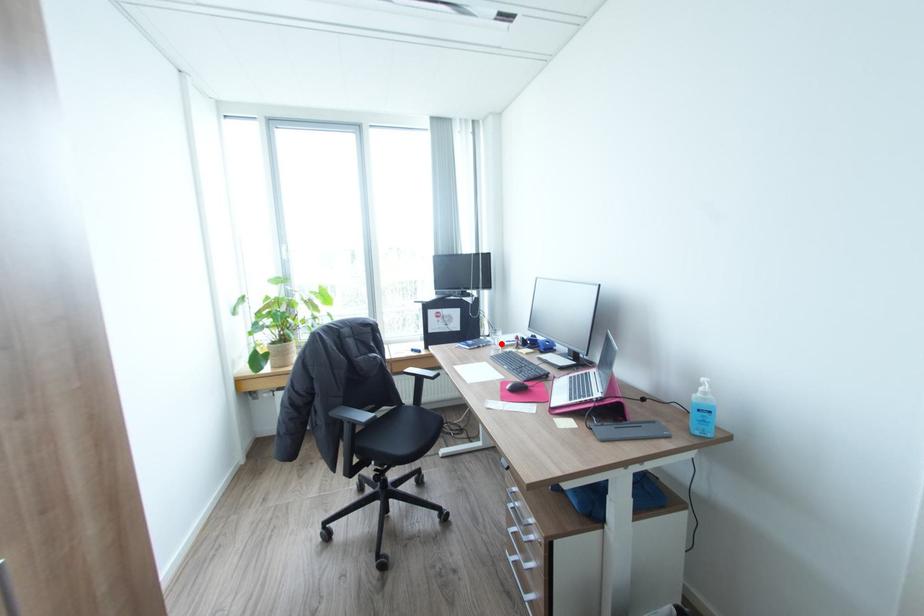
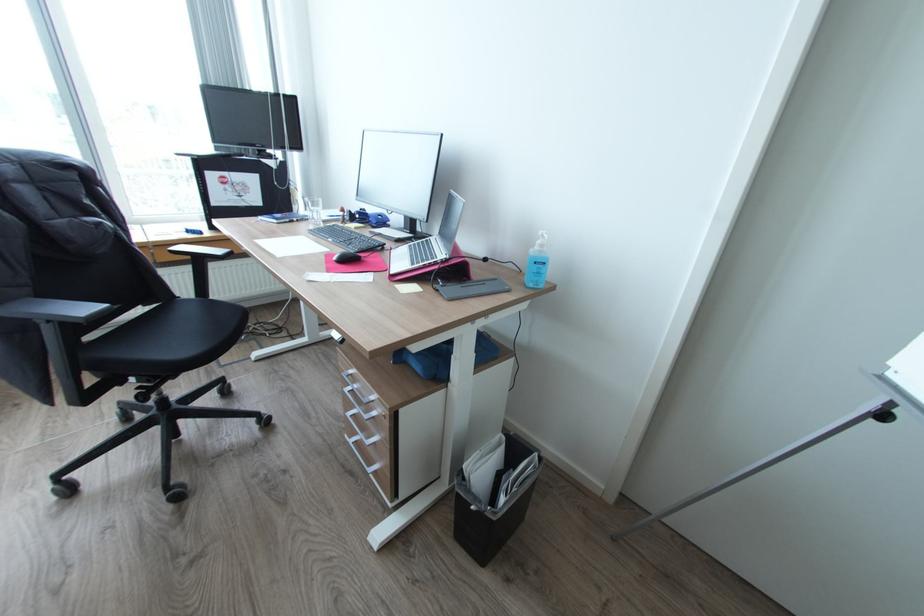
The point at the highlighted location is marked in the first image. Where is the corresponding point in the second image?

(321, 217)